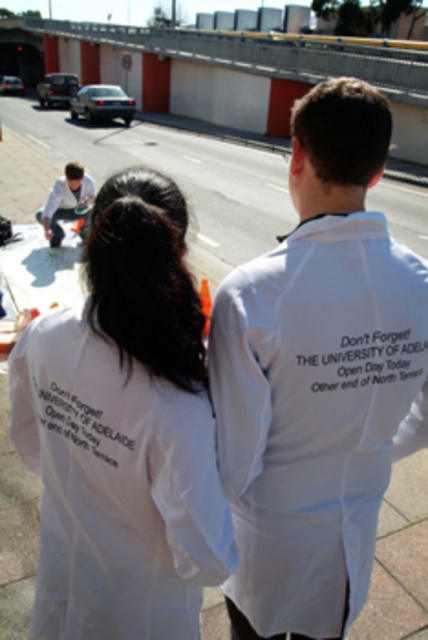
Question: Can you confirm if white cotton shirt at center is smaller than matte white shirt at lower left?

Choices:
 (A) no
 (B) yes

Answer: (B)

Question: Does white cotton hoodie at upper right appear on the left side of white cotton shirt at center?

Choices:
 (A) yes
 (B) no

Answer: (B)

Question: Observing the image, what is the correct spatial positioning of white cotton hoodie at upper right in reference to matte white shirt at lower left?

Choices:
 (A) above
 (B) below

Answer: (B)

Question: Which is nearer to the white cotton hoodie at upper right?

Choices:
 (A) white cotton shirt at center
 (B) matte white shirt at lower left

Answer: (A)

Question: Which point is farther to the camera?

Choices:
 (A) (23, 371)
 (B) (47, 205)

Answer: (B)

Question: Which point appears farthest from the camera in this image?

Choices:
 (A) [x=193, y=536]
 (B) [x=356, y=221]
 (C) [x=50, y=196]

Answer: (C)